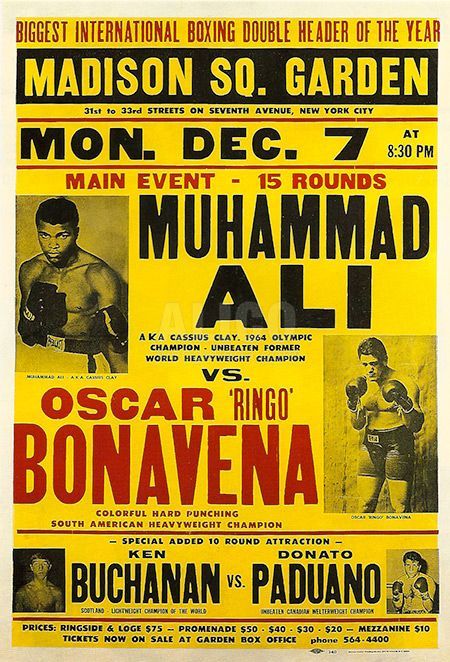
Where is `photographs`? This screenshot has height=662, width=450. photographs is located at coordinates (55, 236), (39, 570), (412, 569), (381, 384).